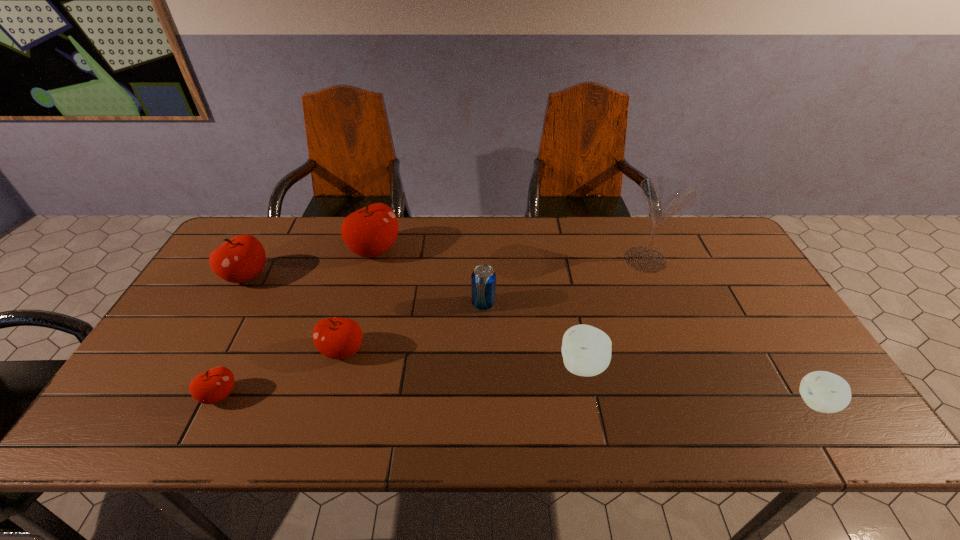
Where is `free space located on the left of the rightmost object`? Image resolution: width=960 pixels, height=540 pixels. free space located on the left of the rightmost object is located at coordinates (663, 403).

The height and width of the screenshot is (540, 960). I want to click on free space located on the right of the smallest red apple, so click(290, 395).

What are the coordinates of `flute glass at the far edge` in the screenshot? It's located at (664, 196).

At what (x,y) coordinates should I click in order to perform the action: click on object that is at the left edge. Please return your answer as a coordinate pair (x, y). The image size is (960, 540). Looking at the image, I should click on (242, 258).

The width and height of the screenshot is (960, 540). Identify the location of object at the right edge. (822, 391).

Image resolution: width=960 pixels, height=540 pixels. In order to click on object at the far left corner in this screenshot , I will do `click(242, 258)`.

Where is `object at the near right corner`? object at the near right corner is located at coordinates (822, 391).

The height and width of the screenshot is (540, 960). Identify the location of vacant region at the far edge of the desktop. pos(303,231).

Locate an element on the screen. vacant region at the near edge of the desktop is located at coordinates (474, 438).

Image resolution: width=960 pixels, height=540 pixels. Identify the location of vacant space at the left edge of the desktop. (178, 353).